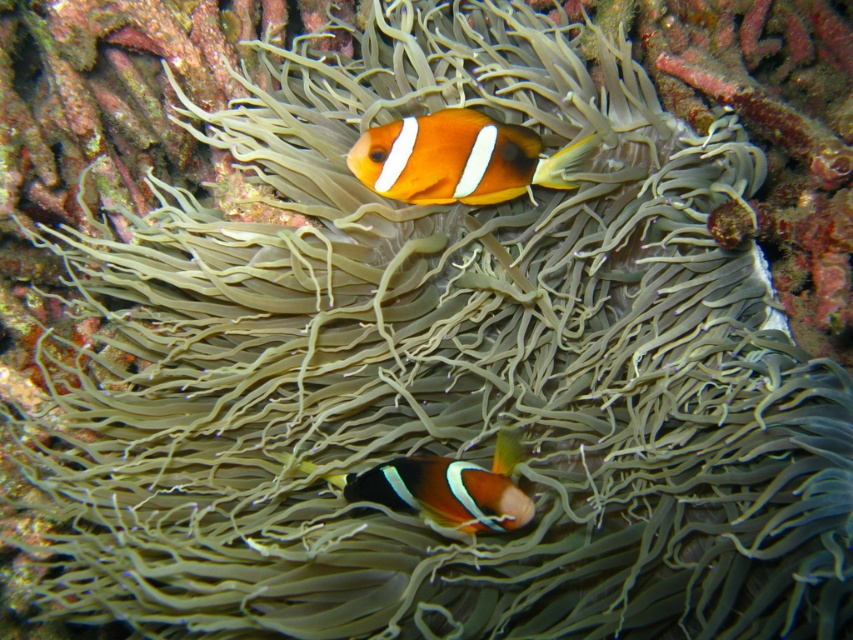
Question: Which of the following is the closest to the observer?

Choices:
 (A) (474, 113)
 (B) (421, 486)

Answer: (B)

Question: Is orange matte clownfish at upper center wider than orange matte clownfish at center?

Choices:
 (A) yes
 (B) no

Answer: (A)

Question: Is orange matte clownfish at upper center thinner than orange matte clownfish at center?

Choices:
 (A) yes
 (B) no

Answer: (B)

Question: Is orange matte clownfish at upper center below orange matte clownfish at center?

Choices:
 (A) yes
 (B) no

Answer: (B)